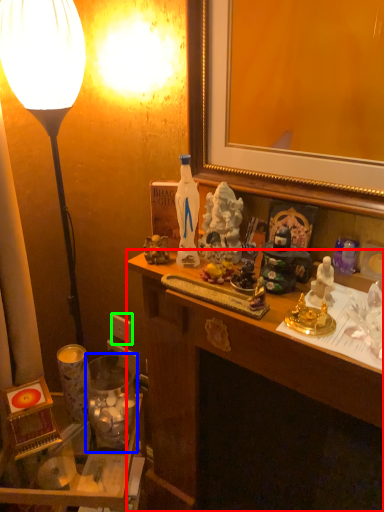
Question: Based on their relative distances, which object is farther from desk (highlighted by a red box)? Choose from candle holder (highlighted by a blue box) and power outlet (highlighted by a green box).

Choices:
 (A) candle holder
 (B) power outlet

Answer: (B)